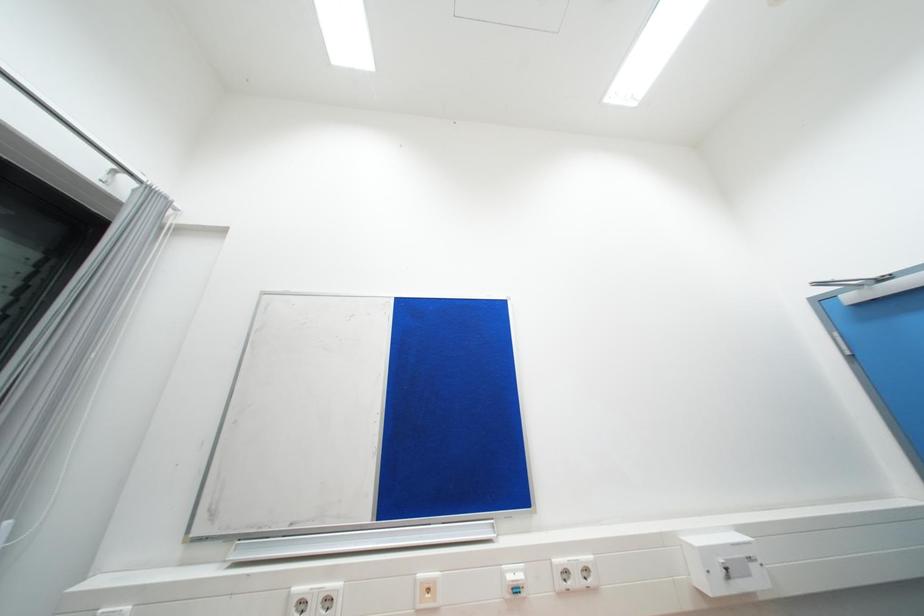
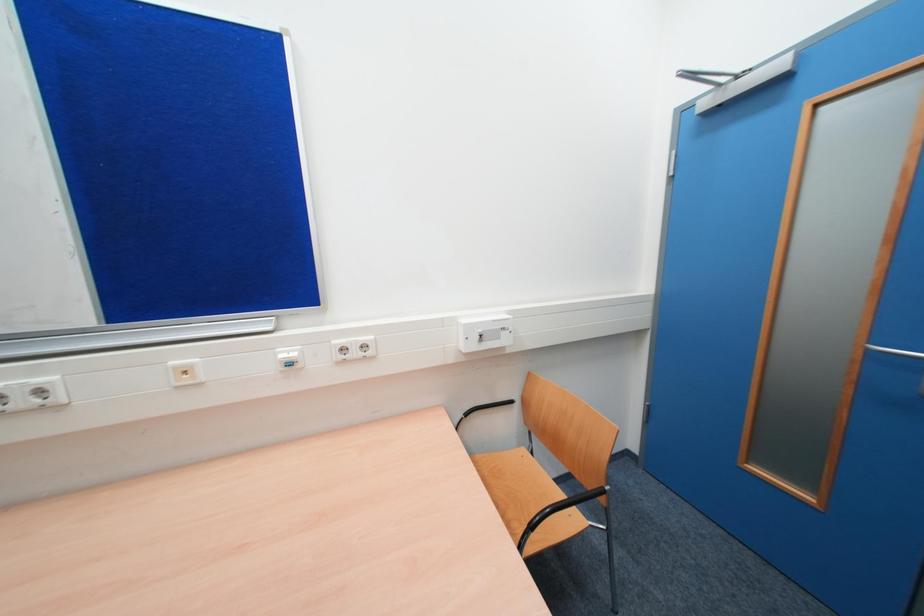
Based on the continuous images, in which direction is the camera rotating?

The camera rotated toward right-down.